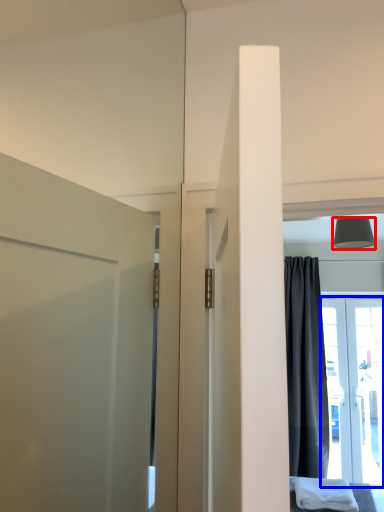
Question: Which object is closer to the camera taking this photo, lamp (highlighted by a red box) or door (highlighted by a blue box)?

Choices:
 (A) lamp
 (B) door

Answer: (A)